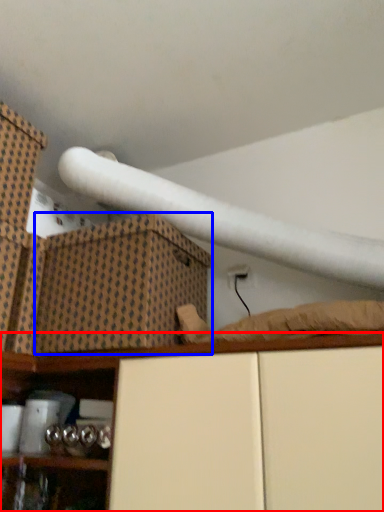
Question: Among these objects, which one is farthest to the camera, shelf (highlighted by a red box) or cardboard box (highlighted by a blue box)?

Choices:
 (A) shelf
 (B) cardboard box

Answer: (B)